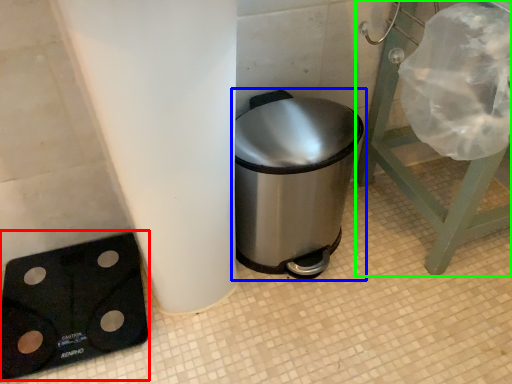
Question: Estimate the real-world distances between objects in this image. Which object is closer to weight scale (highlighted by a red box), waste container (highlighted by a blue box) or furniture (highlighted by a green box)?

Choices:
 (A) waste container
 (B) furniture

Answer: (A)